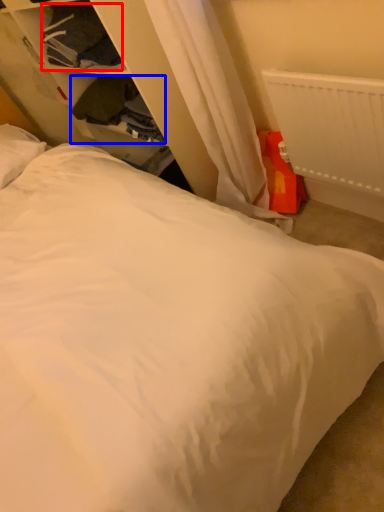
Question: Which object appears closest to the camera in this image, clothing (highlighted by a red box) or clothing (highlighted by a blue box)?

Choices:
 (A) clothing
 (B) clothing

Answer: (A)